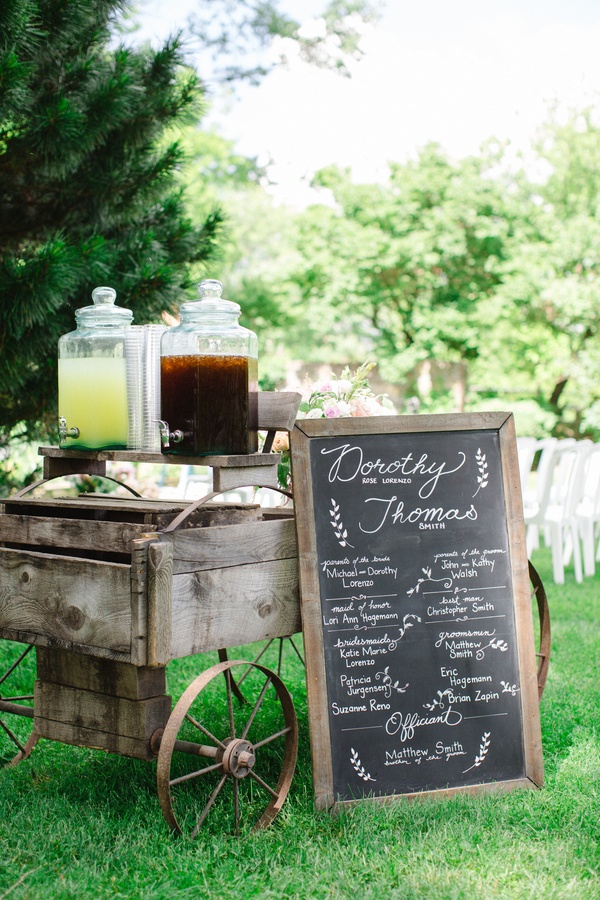
You are a GUI agent. You are given a task and a screenshot of the screen. Output one action in this format:
    pyautogui.click(x=<x>, y=<y>)
    Task: Click on the clear plastic cups
    
    Given the screenshot: What is the action you would take?
    pyautogui.click(x=152, y=360), pyautogui.click(x=136, y=405)